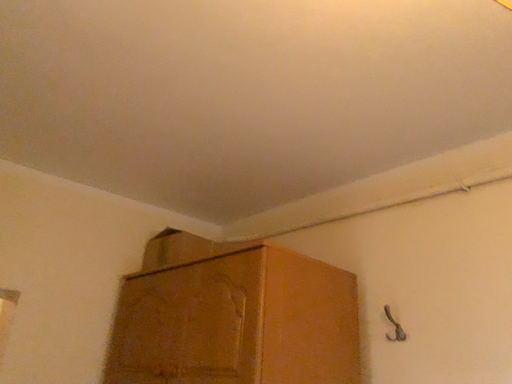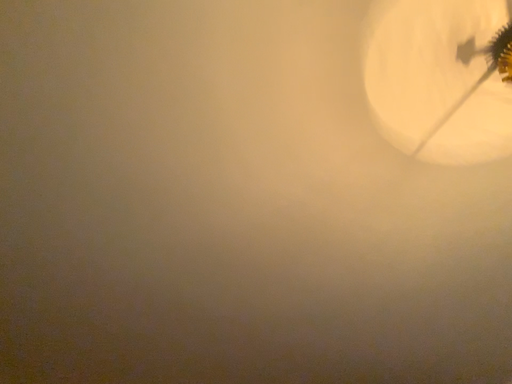
Question: How did the camera likely rotate when shooting the video?

Choices:
 (A) rotated left
 (B) rotated right

Answer: (A)